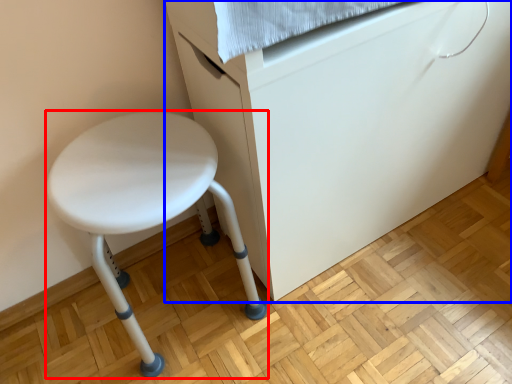
Question: Among these objects, which one is nearest to the camera, stool (highlighted by a red box) or furniture (highlighted by a blue box)?

Choices:
 (A) stool
 (B) furniture

Answer: (B)